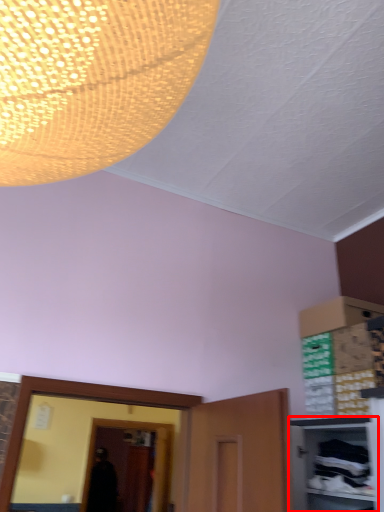
Question: From the image's perspective, what is the correct spatial relationship of cabinetry (annotated by the red box) in relation to glass door?

Choices:
 (A) below
 (B) above

Answer: (B)